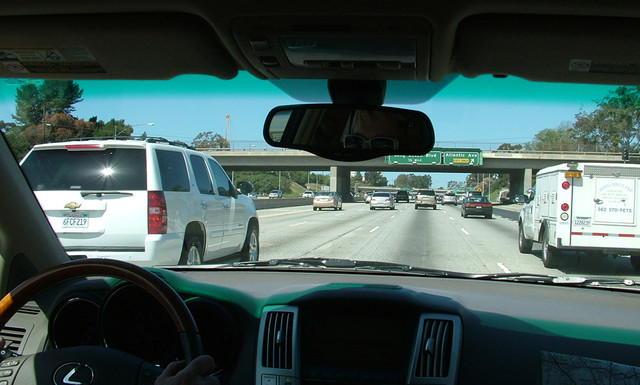
Locate an element on the screen. vent is located at coordinates (284, 347), (425, 358), (11, 335).